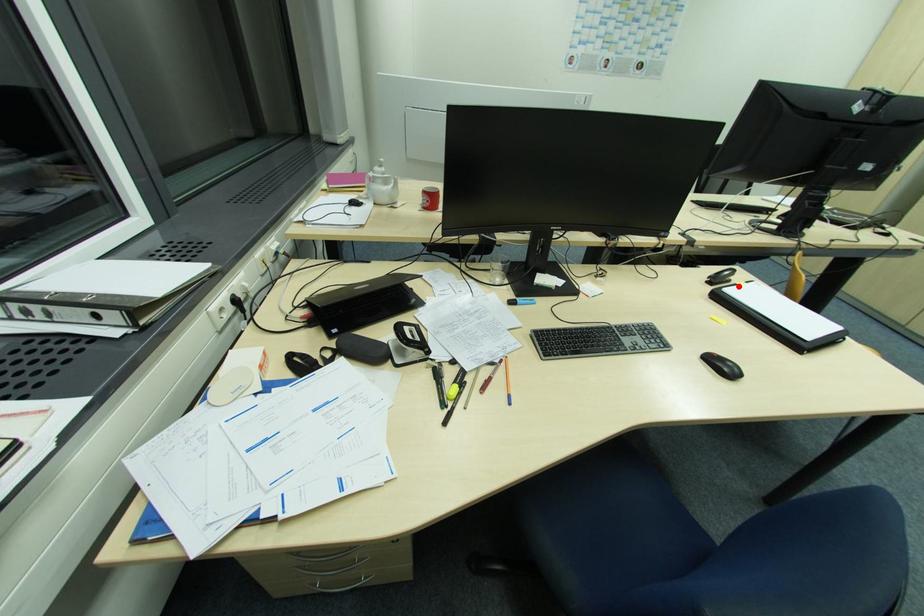
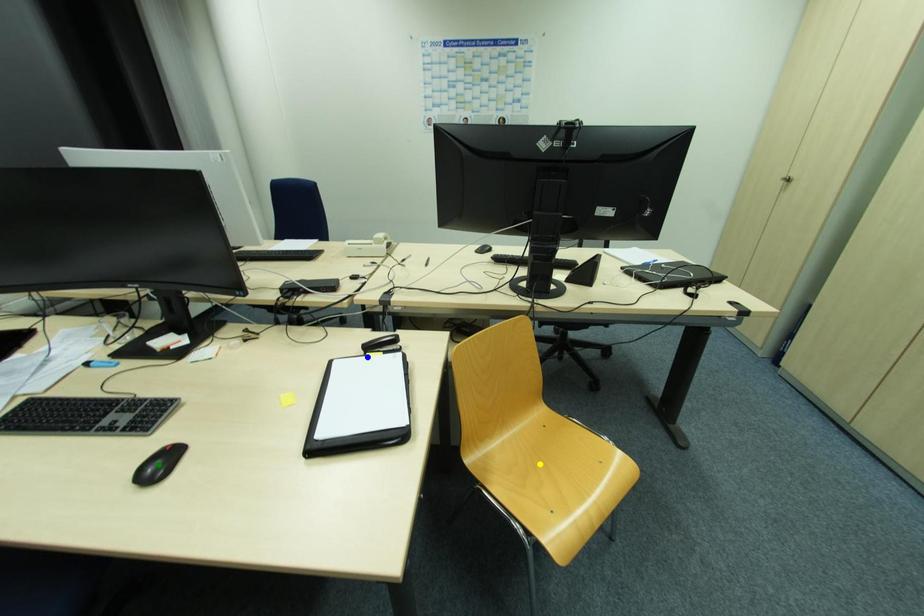
Question: I am providing you with two images of the same scene from different viewpoints. A red point is marked on the first image. You are given multiple points on the second image. Can you choose the point in image 2 that corresponds to the point in image 1?

Choices:
 (A) blue point
 (B) green point
 (C) yellow point

Answer: (A)